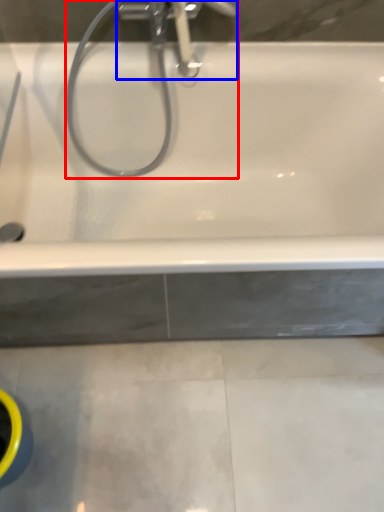
Question: Which object is further to the camera taking this photo, plumbing fixture (highlighted by a red box) or tap (highlighted by a blue box)?

Choices:
 (A) plumbing fixture
 (B) tap

Answer: (B)